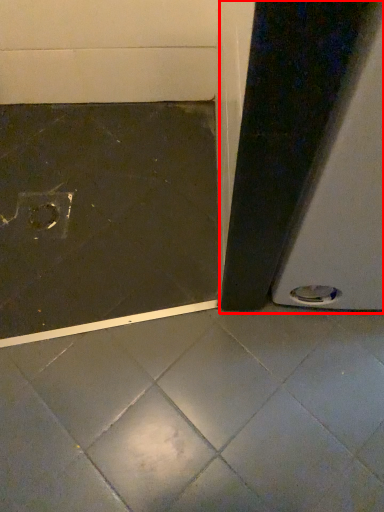
Question: From the image, what is the correct spatial relationship of screen door (annotated by the red box) in relation to concrete?

Choices:
 (A) left
 (B) right

Answer: (B)